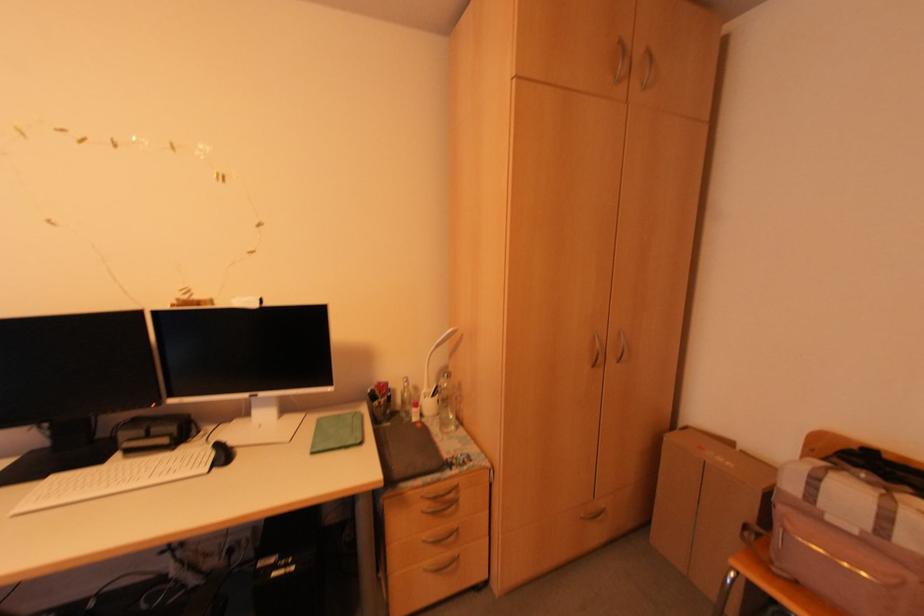
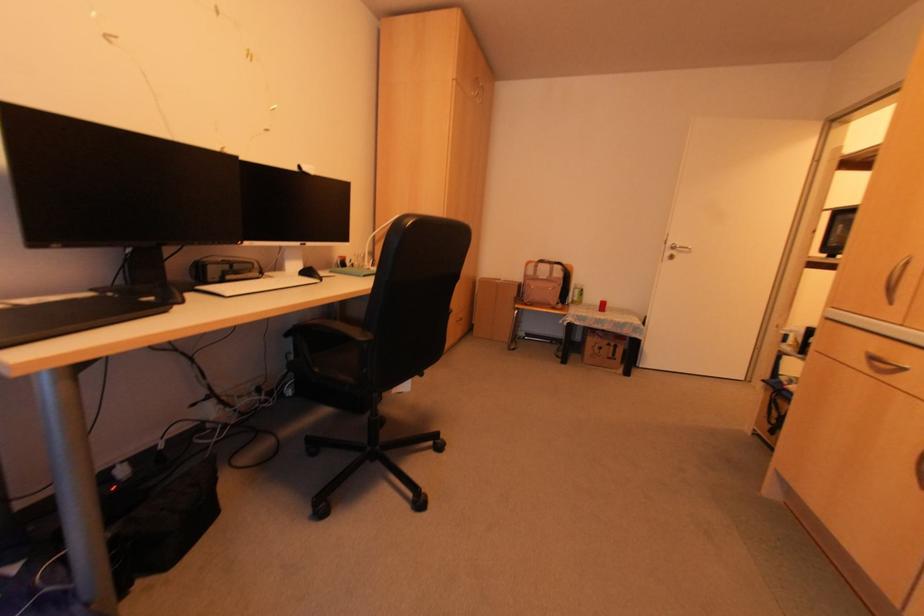
In the second image, find the point that corresponds to point 854,532 in the first image.

(542, 278)